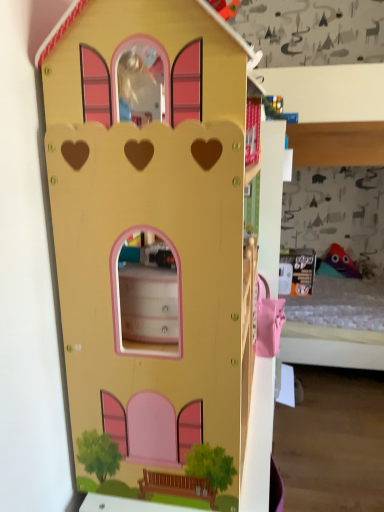
Locate an element on the screen. multicolored fabric toy at right, positioned as the 2th toy in left-to-right order is located at coordinates (338, 264).

Describe the element at coordinates (338, 264) in the screenshot. This screenshot has height=512, width=384. I see `multicolored fabric toy at right, positioned as the 2th toy in left-to-right order` at that location.

This screenshot has width=384, height=512. I want to click on matte yellow castle at center, which is the 1th toy from front to back, so click(153, 246).

The width and height of the screenshot is (384, 512). What do you see at coordinates (153, 246) in the screenshot? I see `matte yellow castle at center, which is the 1th toy from front to back` at bounding box center [153, 246].

I want to click on multicolored fabric toy at right, positioned as the 2th toy in left-to-right order, so click(x=338, y=264).

Considering the relative positions of multicolored fabric toy at right, positioned as the first toy in back-to-front order, and matte yellow castle at center, the first toy from the left, in the image provided, is multicolored fabric toy at right, positioned as the first toy in back-to-front order, to the left or to the right of matte yellow castle at center, the first toy from the left,?

In the image, multicolored fabric toy at right, positioned as the first toy in back-to-front order, appears on the right side of matte yellow castle at center, the first toy from the left.

Is multicolored fabric toy at right, placed as the second toy when sorted from front to back, further to camera compared to matte yellow castle at center, the 2th toy viewed from the back?

Yes, multicolored fabric toy at right, placed as the second toy when sorted from front to back, is behind matte yellow castle at center, the 2th toy viewed from the back.

Does point (358, 273) lie behind point (193, 323)?

Yes, point (358, 273) is farther from viewer.

From the image's perspective, which is below, multicolored fabric toy at right, arranged as the first toy when viewed from the right, or matte yellow castle at center, the 2th toy viewed from the back?

From the image's view, multicolored fabric toy at right, arranged as the first toy when viewed from the right, is below.

From a real-world perspective, is multicolored fabric toy at right, placed as the second toy when sorted from front to back, physically above matte yellow castle at center, the first toy from the left?

No, from a real-world perspective, multicolored fabric toy at right, placed as the second toy when sorted from front to back, is not on top of matte yellow castle at center, the first toy from the left.

Between multicolored fabric toy at right, positioned as the 2th toy in left-to-right order, and matte yellow castle at center, which is the 1th toy from front to back, which one has smaller width?

multicolored fabric toy at right, positioned as the 2th toy in left-to-right order.

From their relative heights in the image, would you say multicolored fabric toy at right, placed as the second toy when sorted from front to back, is taller or shorter than matte yellow castle at center, the first toy from the left?

multicolored fabric toy at right, placed as the second toy when sorted from front to back, is shorter than matte yellow castle at center, the first toy from the left.

Considering the sizes of objects multicolored fabric toy at right, arranged as the first toy when viewed from the right, and matte yellow castle at center, which is counted as the 2th toy, starting from the right, in the image provided, who is smaller, multicolored fabric toy at right, arranged as the first toy when viewed from the right, or matte yellow castle at center, which is counted as the 2th toy, starting from the right,?

multicolored fabric toy at right, arranged as the first toy when viewed from the right.

In the scene shown: Is multicolored fabric toy at right, positioned as the 2th toy in left-to-right order, inside or outside of matte yellow castle at center, which is counted as the 2th toy, starting from the right?

multicolored fabric toy at right, positioned as the 2th toy in left-to-right order, exists outside the volume of matte yellow castle at center, which is counted as the 2th toy, starting from the right.

Is multicolored fabric toy at right, positioned as the 2th toy in left-to-right order, beside matte yellow castle at center, which is the 1th toy from front to back?

No, multicolored fabric toy at right, positioned as the 2th toy in left-to-right order, is not in contact with matte yellow castle at center, which is the 1th toy from front to back.

Is multicolored fabric toy at right, arranged as the first toy when viewed from the right, facing towards matte yellow castle at center, which is counted as the 2th toy, starting from the right?

Yes, multicolored fabric toy at right, arranged as the first toy when viewed from the right, is oriented towards matte yellow castle at center, which is counted as the 2th toy, starting from the right.

How many degrees apart are the facing directions of multicolored fabric toy at right, placed as the second toy when sorted from front to back, and matte yellow castle at center, the first toy from the left?

They differ by 89.9 degrees in their facing directions.

Identify the location of toy located above the multicolored fabric toy at right, placed as the second toy when sorted from front to back (from the image's perspective). This screenshot has height=512, width=384. (153, 246).

Is matte yellow castle at center, the 2th toy viewed from the back, at the right side of multicolored fabric toy at right, positioned as the first toy in back-to-front order?

No, matte yellow castle at center, the 2th toy viewed from the back, is not to the right of multicolored fabric toy at right, positioned as the first toy in back-to-front order.

Does matte yellow castle at center, which is the 1th toy from front to back, come behind multicolored fabric toy at right, positioned as the 2th toy in left-to-right order?

No, matte yellow castle at center, which is the 1th toy from front to back, is closer to the camera.

Does point (122, 146) appear closer or farther from the camera than point (329, 272)?

Point (122, 146) is closer to the camera than point (329, 272).

From the image's perspective, is matte yellow castle at center, the first toy from the left, beneath multicolored fabric toy at right, positioned as the first toy in back-to-front order?

No, from the image's perspective, matte yellow castle at center, the first toy from the left, is not below multicolored fabric toy at right, positioned as the first toy in back-to-front order.

From a real-world perspective, which object rests below the other?

From a 3D spatial view, multicolored fabric toy at right, positioned as the 2th toy in left-to-right order, is below.

Looking at their sizes, would you say matte yellow castle at center, which is the 1th toy from front to back, is wider or thinner than multicolored fabric toy at right, positioned as the 2th toy in left-to-right order?

matte yellow castle at center, which is the 1th toy from front to back, is wider than multicolored fabric toy at right, positioned as the 2th toy in left-to-right order.

Can you confirm if matte yellow castle at center, which is the 1th toy from front to back, is taller than multicolored fabric toy at right, positioned as the 2th toy in left-to-right order?

Correct, matte yellow castle at center, which is the 1th toy from front to back, is much taller as multicolored fabric toy at right, positioned as the 2th toy in left-to-right order.

Which of these two, matte yellow castle at center, which is counted as the 2th toy, starting from the right, or multicolored fabric toy at right, placed as the second toy when sorted from front to back, is smaller?

multicolored fabric toy at right, placed as the second toy when sorted from front to back.

Is matte yellow castle at center, which is counted as the 2th toy, starting from the right, completely or partially outside of multicolored fabric toy at right, positioned as the first toy in back-to-front order?

Yes, matte yellow castle at center, which is counted as the 2th toy, starting from the right, is located beyond the bounds of multicolored fabric toy at right, positioned as the first toy in back-to-front order.

Is matte yellow castle at center, the 2th toy viewed from the back, not near multicolored fabric toy at right, arranged as the first toy when viewed from the right?

Yes, matte yellow castle at center, the 2th toy viewed from the back, and multicolored fabric toy at right, arranged as the first toy when viewed from the right, are quite far apart.

Could you tell me if matte yellow castle at center, which is the 1th toy from front to back, is turned towards multicolored fabric toy at right, positioned as the first toy in back-to-front order?

No, matte yellow castle at center, which is the 1th toy from front to back, is not turned towards multicolored fabric toy at right, positioned as the first toy in back-to-front order.

How different are the orientations of matte yellow castle at center, which is counted as the 2th toy, starting from the right, and multicolored fabric toy at right, positioned as the first toy in back-to-front order, in degrees?

The angular difference between matte yellow castle at center, which is counted as the 2th toy, starting from the right, and multicolored fabric toy at right, positioned as the first toy in back-to-front order, is 89.9 degrees.

Could you measure the distance between matte yellow castle at center, the 2th toy viewed from the back, and multicolored fabric toy at right, arranged as the first toy when viewed from the right?

The distance of matte yellow castle at center, the 2th toy viewed from the back, from multicolored fabric toy at right, arranged as the first toy when viewed from the right, is 7.95 feet.

Identify the location of toy on the right of the matte yellow castle at center, the first toy from the left. The height and width of the screenshot is (512, 384). (338, 264).

Where is `toy located behind the matte yellow castle at center, the 2th toy viewed from the back`? The image size is (384, 512). toy located behind the matte yellow castle at center, the 2th toy viewed from the back is located at coordinates (338, 264).

Where is `toy on the right of matte yellow castle at center, the 2th toy viewed from the back`? toy on the right of matte yellow castle at center, the 2th toy viewed from the back is located at coordinates point(338,264).